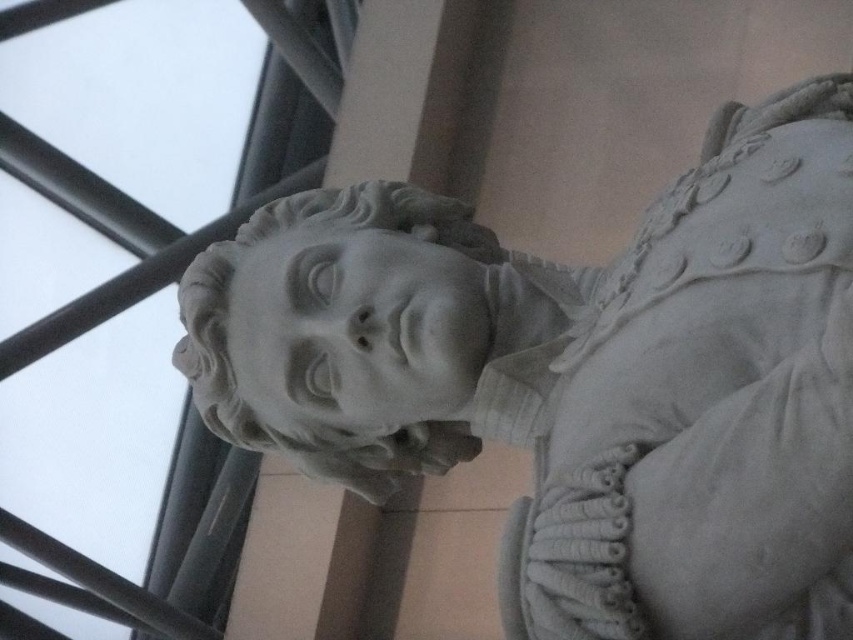
You are an art conservator assessing the dimensions of two white marble sculptures displayed in a gallery. You need to determine if the white marble bust at center is wider than the white marble head at center. Based on your observation, which one is wider?

The white marble bust at center is wider than the white marble head at center according to the description provided.

You are a visitor in a museum and you see the white marble bust at center and the white marble head at center. Which one is closer to you?

The white marble bust at center is closer to you as it is in front of the white marble head at center.

You are an art conservator standing in front of the white marble bust at center. You need to place a protective barrier around it. The barrier requires a 1.2 meter radius clearance around the bust. Can you determine if the space allows for this clearance based on its position at point 0.591, 0.679?

The white marble bust at center is positioned at coordinates (578, 378). To determine if a 1.2 meter radius barrier can be placed, the exact dimensions of the space and the distance from the bust to surrounding objects are needed, which are not provided in the scene description. Therefore, it is impossible to confirm the clearance without additional information.